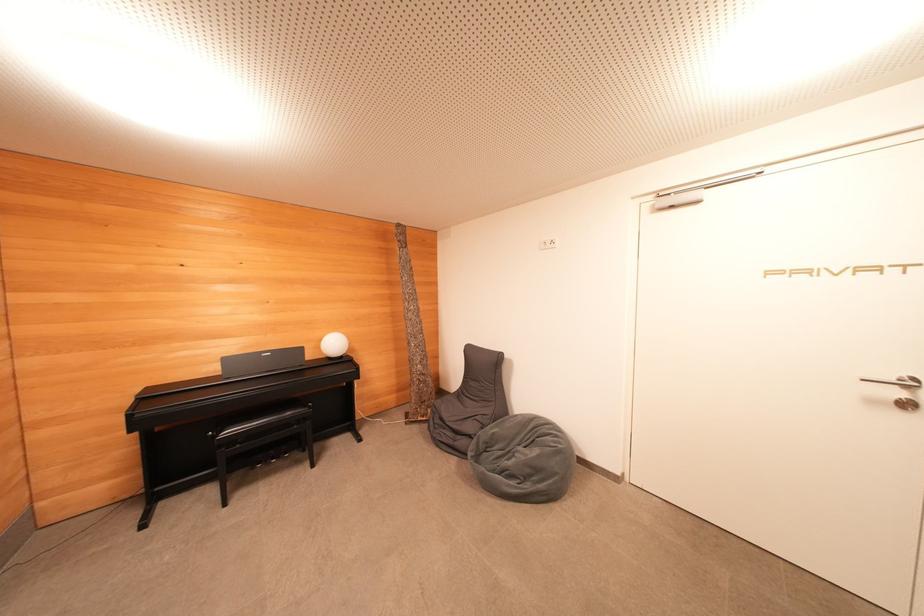
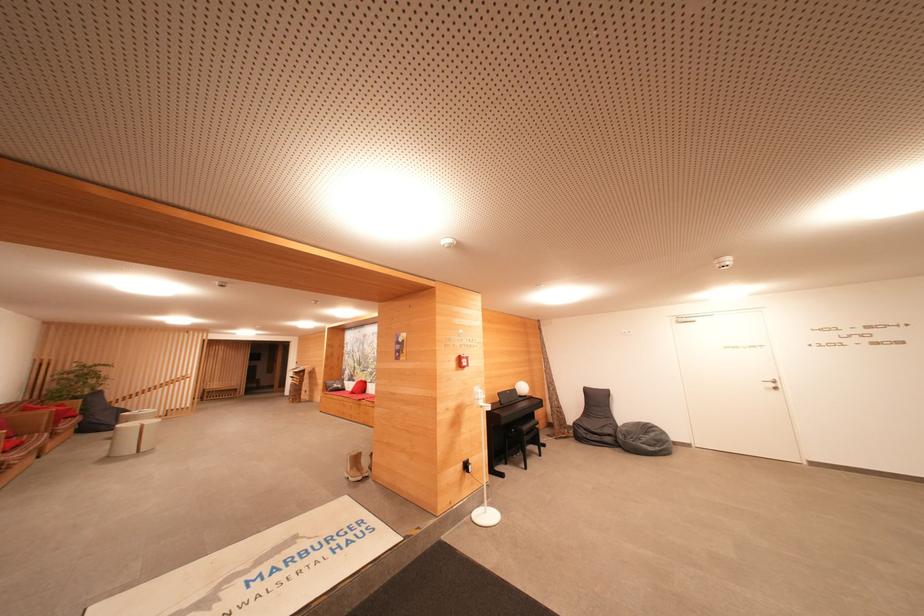
Find the pixel in the second image that matches point 540,455 in the first image.

(655, 438)